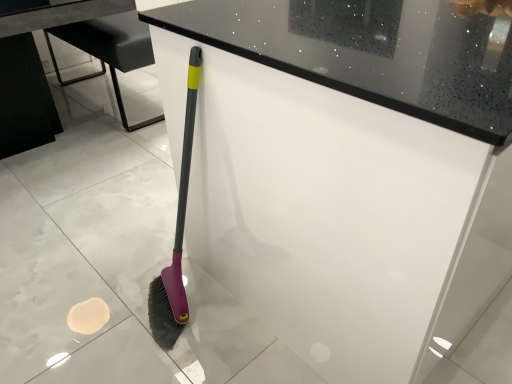
Question: Is black glossy table at lower left thinner than white glossy counter at center?

Choices:
 (A) yes
 (B) no

Answer: (A)

Question: Is black glossy table at lower left taller than white glossy counter at center?

Choices:
 (A) no
 (B) yes

Answer: (A)

Question: From a real-world perspective, does black glossy table at lower left stand above white glossy counter at center?

Choices:
 (A) yes
 (B) no

Answer: (B)

Question: Considering the relative sizes of black glossy table at lower left and white glossy counter at center in the image provided, is black glossy table at lower left bigger than white glossy counter at center?

Choices:
 (A) yes
 (B) no

Answer: (B)

Question: Is white glossy counter at center at the back of black glossy table at lower left?

Choices:
 (A) no
 (B) yes

Answer: (A)

Question: Can we say black glossy table at lower left lies outside white glossy counter at center?

Choices:
 (A) yes
 (B) no

Answer: (A)

Question: Is black glossy table at lower left taller than metallic gray table at center?

Choices:
 (A) no
 (B) yes

Answer: (B)

Question: Can you confirm if black glossy table at lower left is positioned to the left of metallic gray table at center?

Choices:
 (A) no
 (B) yes

Answer: (B)

Question: Does black glossy table at lower left have a lesser height compared to metallic gray table at center?

Choices:
 (A) yes
 (B) no

Answer: (B)

Question: Does black glossy table at lower left touch metallic gray table at center?

Choices:
 (A) yes
 (B) no

Answer: (B)

Question: Does black glossy table at lower left come in front of metallic gray table at center?

Choices:
 (A) yes
 (B) no

Answer: (A)

Question: From the image's perspective, is black glossy table at lower left on top of metallic gray table at center?

Choices:
 (A) no
 (B) yes

Answer: (A)

Question: Is black glossy table at lower left completely or partially inside metallic gray table at center?

Choices:
 (A) yes
 (B) no

Answer: (B)